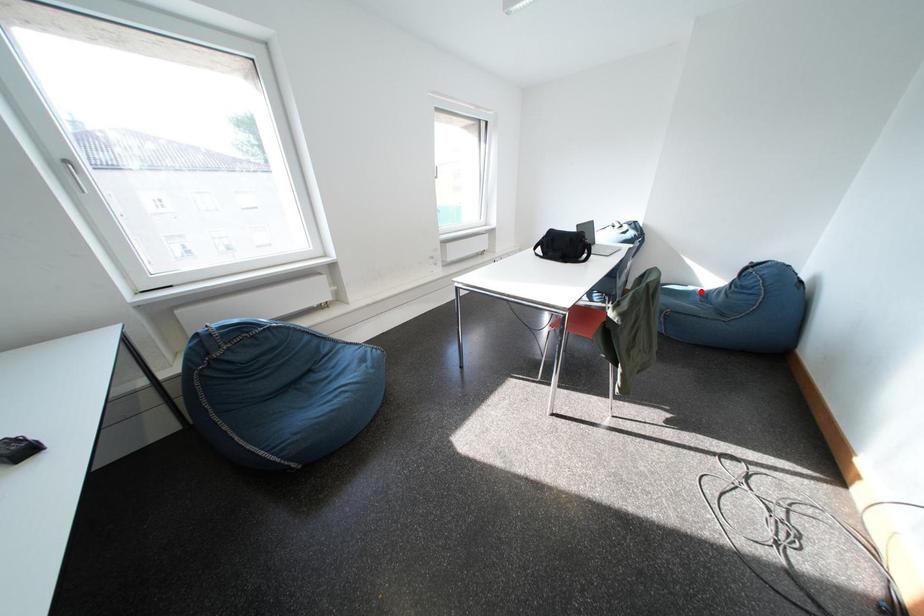
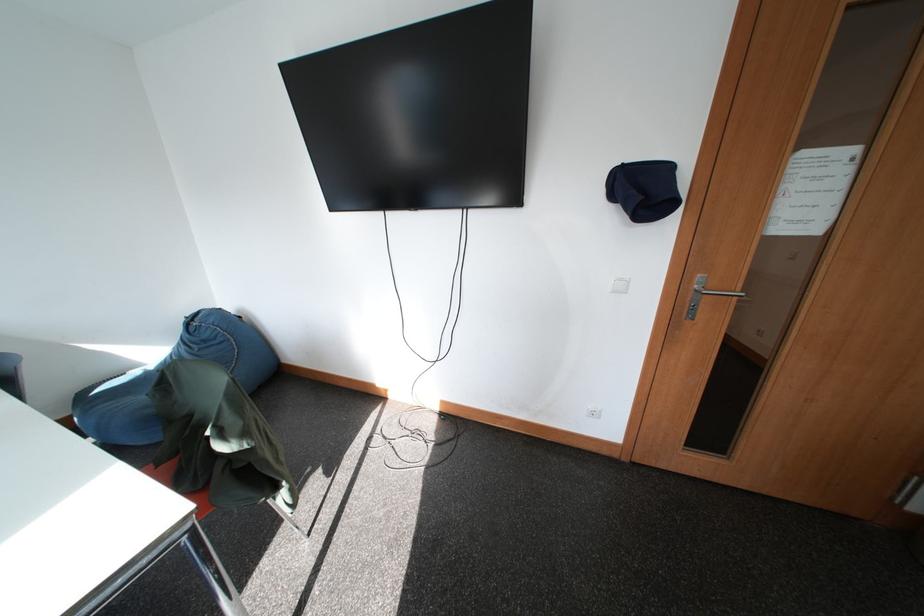
Find the pixel in the second image that matches the highlighted location in the first image.

(146, 377)